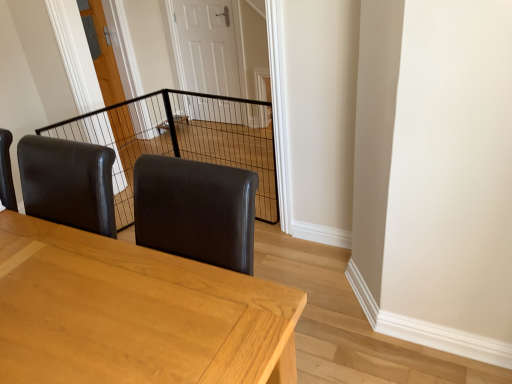
Question: From a real-world perspective, is white glossy door at center, the first door positioned from the right, located beneath light brown wooden table at center?

Choices:
 (A) no
 (B) yes

Answer: (A)

Question: Is the position of white glossy door at center, which appears as the second door when viewed from the left, more distant than that of light brown wooden table at center?

Choices:
 (A) no
 (B) yes

Answer: (B)

Question: From the image's perspective, is white glossy door at center, the first door positioned from the right, located above light brown wooden table at center?

Choices:
 (A) yes
 (B) no

Answer: (A)

Question: Is white glossy door at center, the first door positioned from the right, at the left side of light brown wooden table at center?

Choices:
 (A) no
 (B) yes

Answer: (A)

Question: Is white glossy door at center, which appears as the second door when viewed from the left, located outside light brown wooden table at center?

Choices:
 (A) yes
 (B) no

Answer: (A)

Question: Considering the relative sizes of white glossy door at center, the first door positioned from the right, and light brown wooden table at center in the image provided, is white glossy door at center, the first door positioned from the right, shorter than light brown wooden table at center?

Choices:
 (A) no
 (B) yes

Answer: (A)

Question: Considering the relative sizes of light brown wooden table at center and wooden door at center, the second door from the right, in the image provided, is light brown wooden table at center thinner than wooden door at center, the second door from the right,?

Choices:
 (A) yes
 (B) no

Answer: (B)

Question: Is light brown wooden table at center aimed at wooden door at center, the first door positioned from the left?

Choices:
 (A) no
 (B) yes

Answer: (B)

Question: Can you confirm if light brown wooden table at center is positioned to the right of wooden door at center, the second door from the right?

Choices:
 (A) no
 (B) yes

Answer: (B)

Question: Is light brown wooden table at center next to wooden door at center, the second door from the right?

Choices:
 (A) no
 (B) yes

Answer: (A)

Question: Is light brown wooden table at center oriented away from wooden door at center, the second door from the right?

Choices:
 (A) no
 (B) yes

Answer: (A)

Question: Is light brown wooden table at center wider than wooden door at center, the first door positioned from the left?

Choices:
 (A) yes
 (B) no

Answer: (A)

Question: Is wooden door at center, the second door from the right, taller than white glossy door at center, which appears as the second door when viewed from the left?

Choices:
 (A) no
 (B) yes

Answer: (B)